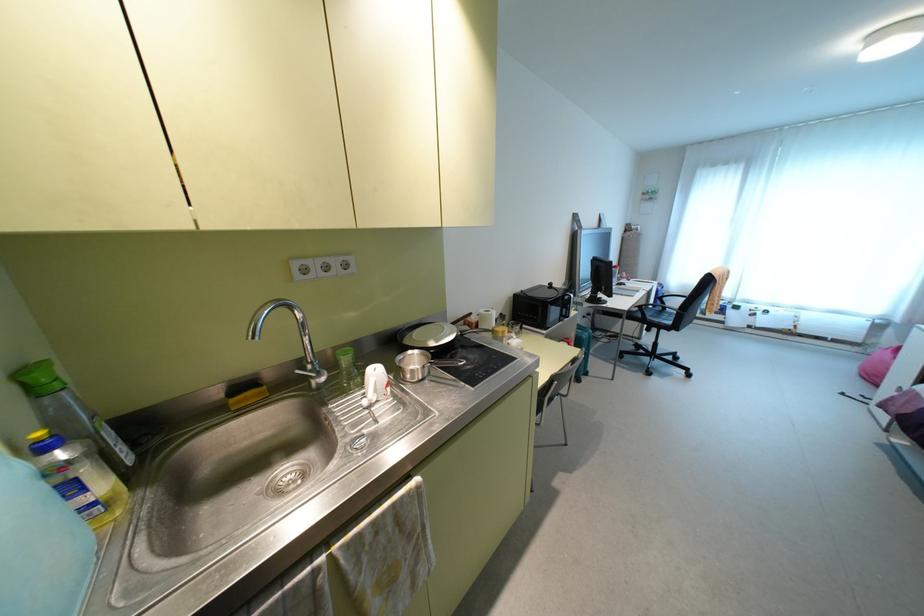
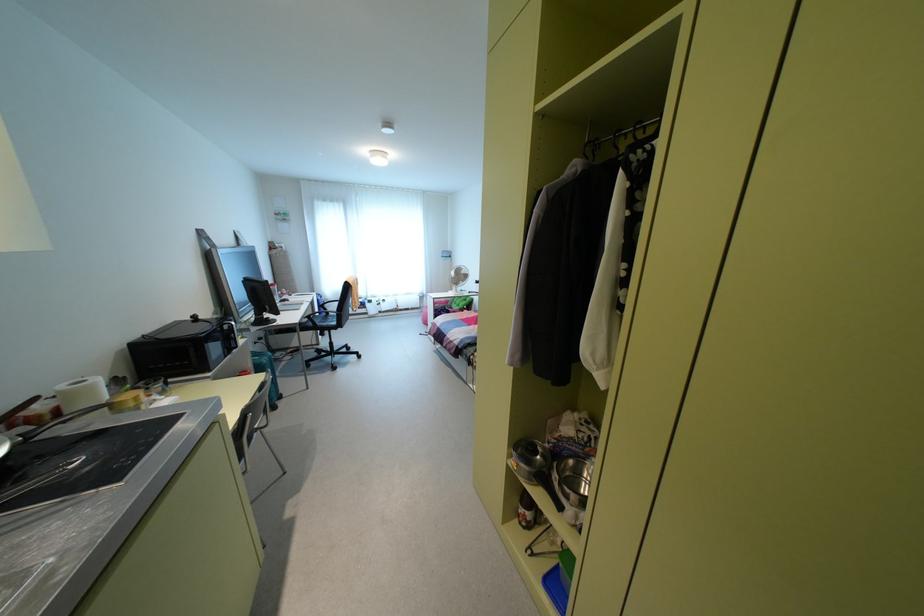
Locate, in the second image, the point that corresponds to the point at 638,306 in the first image.

(309, 315)